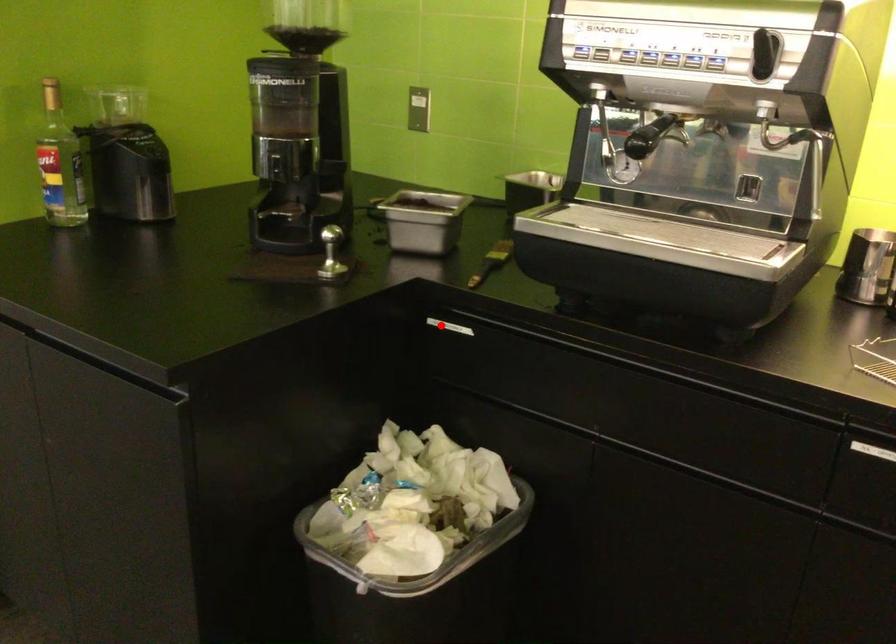
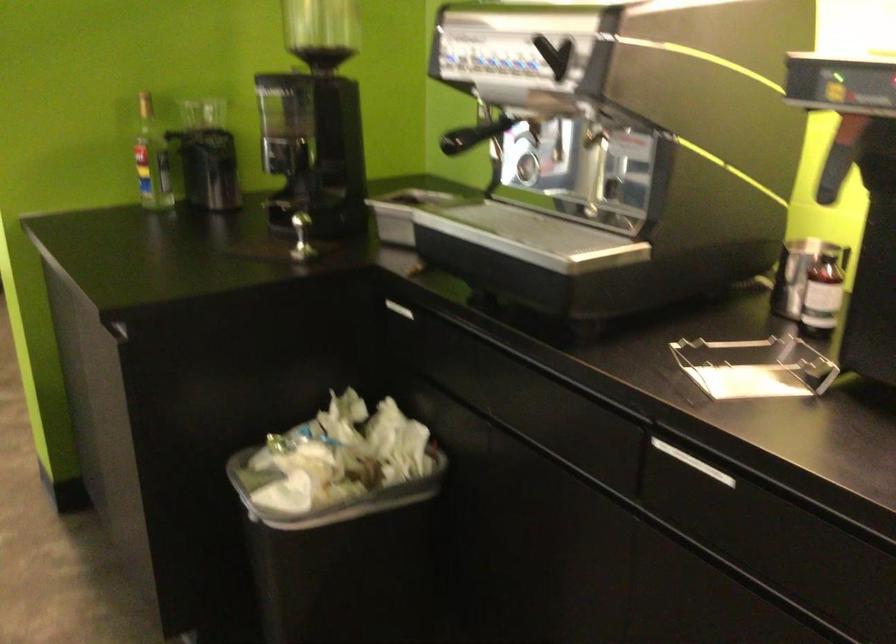
Question: A red point is marked in image1. In image2, is the corresponding 3D point closer to the camera or farther? Reply with the corresponding letter.

Choices:
 (A) The corresponding 3D point is closer.
 (B) The corresponding 3D point is farther.

Answer: (B)